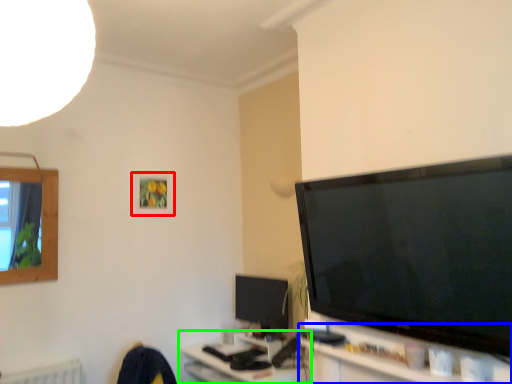
Question: Estimate the real-world distances between objects in this image. Which object is farther from picture frame (highlighted by a red box), tv cabinet (highlighted by a blue box) or computer (highlighted by a green box)?

Choices:
 (A) tv cabinet
 (B) computer

Answer: (A)